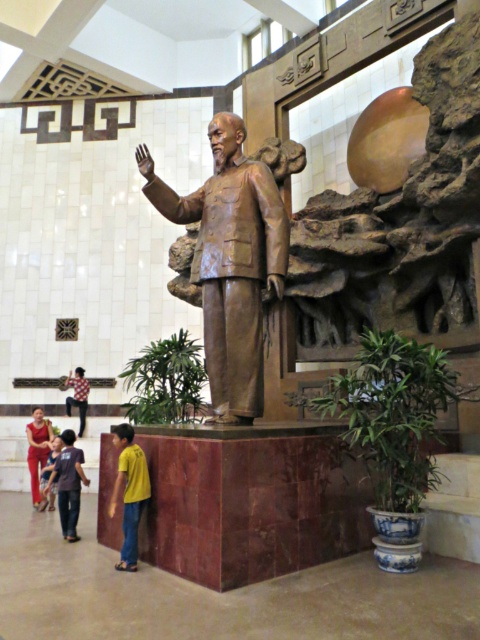
Who is positioned more to the right, bronze statue at center or matte blue shirt at lower left?

Positioned to the right is bronze statue at center.

Which is in front, point (202, 193) or point (58, 440)?

Point (202, 193)

Find the location of `bronze statue at center`. bronze statue at center is located at coordinates (230, 262).

Is checkered shirt at lower left to the left of matte blue shirt at lower left from the viewer's perspective?

Indeed, checkered shirt at lower left is positioned on the left side of matte blue shirt at lower left.

You are a GUI agent. You are given a task and a screenshot of the screen. Output one action in this format:
    pyautogui.click(x=<x>, y=<y>)
    Task: Click on the checkered shirt at lower left
    
    Given the screenshot: What is the action you would take?
    pyautogui.click(x=78, y=396)

The image size is (480, 640). In order to click on checkered shirt at lower left in this screenshot , I will do `click(78, 396)`.

Between yellow cotton shirt at lower left and matte red pants at lower left, which one is positioned lower?

matte red pants at lower left

Can you confirm if yellow cotton shirt at lower left is taller than matte red pants at lower left?

In fact, yellow cotton shirt at lower left may be shorter than matte red pants at lower left.

What do you see at coordinates (130, 492) in the screenshot? This screenshot has width=480, height=640. I see `yellow cotton shirt at lower left` at bounding box center [130, 492].

Find the location of a particular element. The width and height of the screenshot is (480, 640). yellow cotton shirt at lower left is located at coordinates (130, 492).